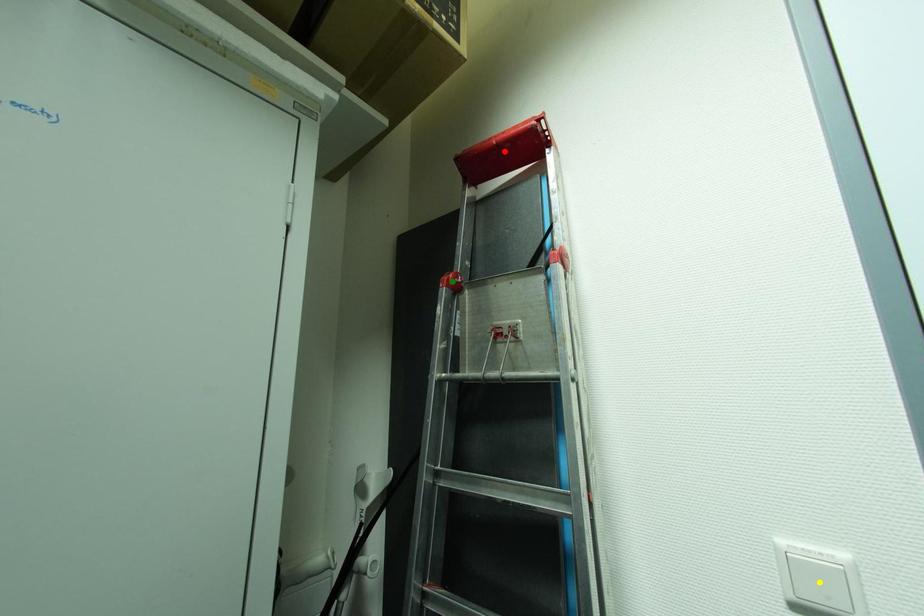
Order these from nearest to farthest:
green point
red point
yellow point

red point, green point, yellow point